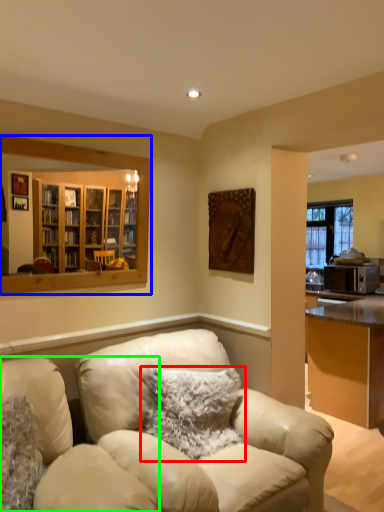
Question: Which object is positioned closest to pillow (highlighted by a red box)? Select from mirror (highlighted by a blue box) and chair (highlighted by a green box).

Choices:
 (A) mirror
 (B) chair

Answer: (B)